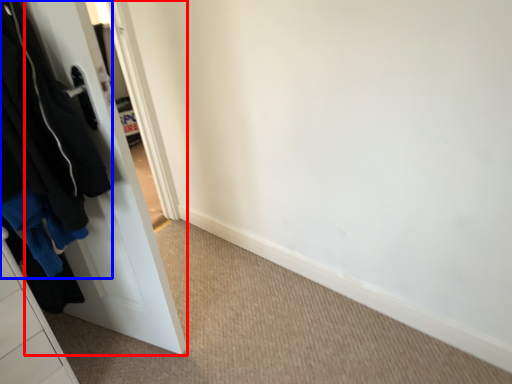
Question: Which of the following is the farthest to the observer, door (highlighted by a red box) or clothing (highlighted by a blue box)?

Choices:
 (A) door
 (B) clothing

Answer: (A)